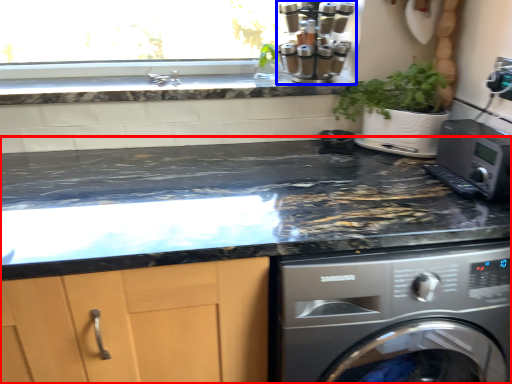
Question: Which object appears farthest to the camera in this image, countertop (highlighted by a red box) or coffee machine (highlighted by a blue box)?

Choices:
 (A) countertop
 (B) coffee machine

Answer: (B)